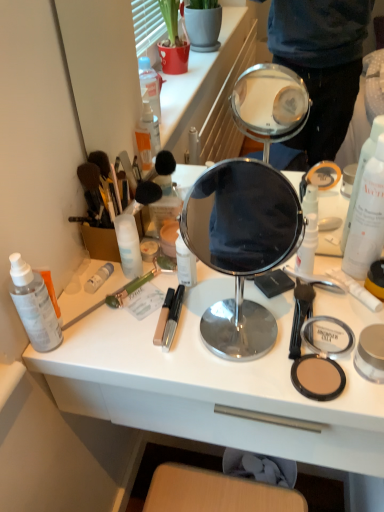
Where is `vacant space that's between polished silver mirror at center and transparent plastic spray bottle at left, which is the 6th toiletry in right-to-left order`? vacant space that's between polished silver mirror at center and transparent plastic spray bottle at left, which is the 6th toiletry in right-to-left order is located at coordinates [x=132, y=338].